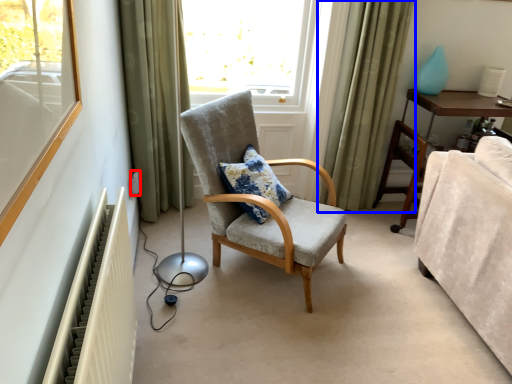
Question: Which object appears farthest to the camera in this image, electric outlet (highlighted by a red box) or curtain (highlighted by a blue box)?

Choices:
 (A) electric outlet
 (B) curtain

Answer: (A)